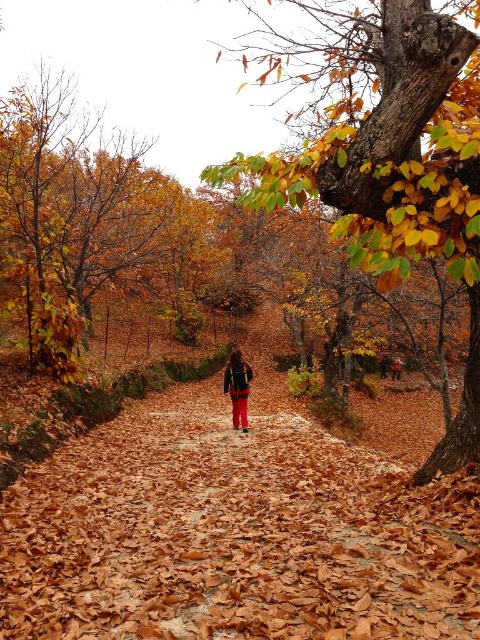
Who is positioned more to the right, brown leafy path at center or matte black backpack at center?

matte black backpack at center

Where is `brown leafy path at center`? The width and height of the screenshot is (480, 640). brown leafy path at center is located at coordinates (233, 532).

The width and height of the screenshot is (480, 640). Find the location of `brown leafy path at center`. brown leafy path at center is located at coordinates (233, 532).

Can you confirm if brown leafy path at center is positioned to the left of smooth bark tree at center?

Yes, brown leafy path at center is to the left of smooth bark tree at center.

The width and height of the screenshot is (480, 640). Describe the element at coordinates (233, 532) in the screenshot. I see `brown leafy path at center` at that location.

Between point (442, 518) and point (396, 204), which one is positioned in front?

Point (442, 518) is more forward.

Where is `brown leafy path at center`? brown leafy path at center is located at coordinates (233, 532).

Can you confirm if smooth bark tree at center is positioned to the right of matte black backpack at center?

Yes, smooth bark tree at center is to the right of matte black backpack at center.

Between point (467, 458) and point (228, 374), which one is positioned in front?

Point (467, 458)

This screenshot has width=480, height=640. Identify the location of smooth bark tree at center. (384, 150).